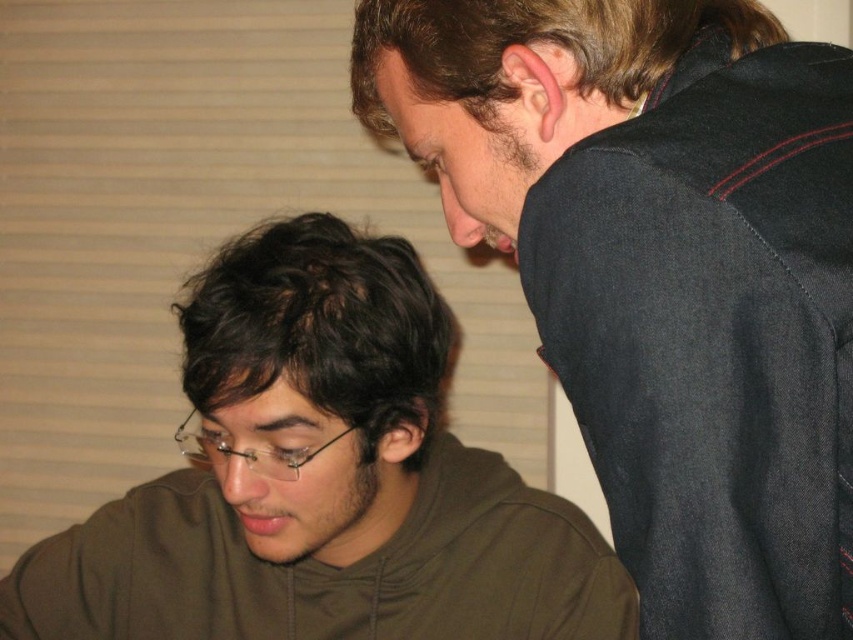
Question: Is dark gray fabric at upper right bigger than brown matte hoodie at lower left?

Choices:
 (A) yes
 (B) no

Answer: (B)

Question: Is dark gray fabric at upper right below brown matte hoodie at lower left?

Choices:
 (A) no
 (B) yes

Answer: (A)

Question: Among these objects, which one is farthest from the camera?

Choices:
 (A) dark gray fabric at upper right
 (B) brown matte hoodie at lower left

Answer: (B)

Question: Observing the image, what is the correct spatial positioning of dark gray fabric at upper right in reference to brown matte hoodie at lower left?

Choices:
 (A) above
 (B) below

Answer: (A)